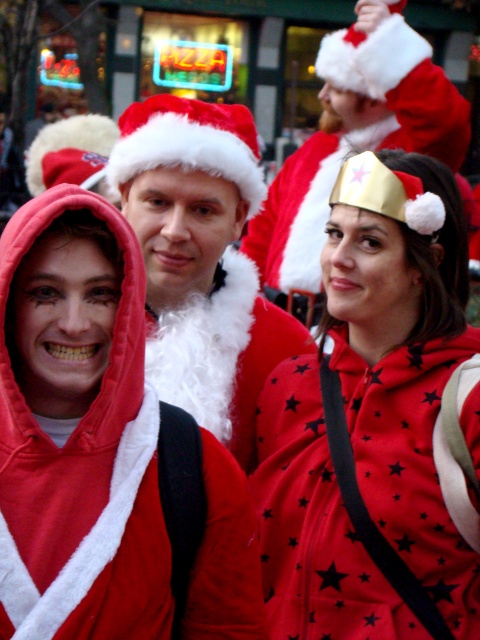
You are a costume designer assessing the festive scene. You notice the matte gold crown at center and the fuzzy red coat at center. Which of these two items has a smaller width?

The matte gold crown at center is thinner than the fuzzy red coat at center, so the matte gold crown at center has a smaller width.

You are a photographer at the event and want to position a camera to capture both the matte gold crown at center and the fuzzy red coat at center in the same frame. Which object should you place on the left side of the camera frame to ensure both are visible?

To capture both the matte gold crown at center and the fuzzy red coat at center in the same frame, you should position the fuzzy red coat at center on the left side of the camera frame. Since the matte gold crown at center is to the right of the fuzzy red coat at center, placing the fuzzy red coat at center on the left will allow the matte gold crown at center to naturally fall to the right within the frame, ensuring both are visible.

You are a photographer setting up for a group photo. You need to position two accessories, the matte gold crown at center and the velvet santa hat at center, so that they are exactly 10 feet apart for better visibility in the photo. Based on the current scene, will you need to move them closer or farther apart?

The matte gold crown at center and the velvet santa hat at center are currently 13.81 feet apart. Since 13.81 feet is more than 10 feet, you need to move them closer to achieve the desired 10 feet distance.